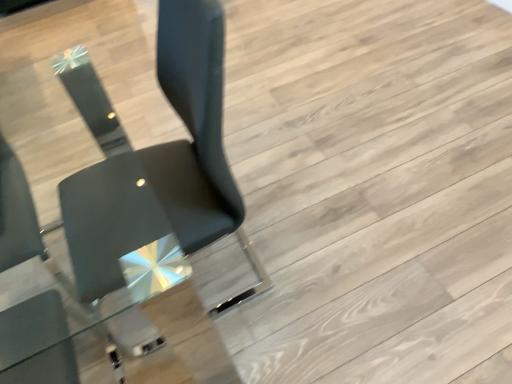
Question: Is matte black chair at center, the second chair in the left-to-right sequence, bigger or smaller than matte black chair at lower left, which is the 1th chair in left-to-right order?

Choices:
 (A) small
 (B) big

Answer: (B)

Question: Looking at their shapes, would you say matte black chair at center, the second chair in the left-to-right sequence, is wider or thinner than matte black chair at lower left, arranged as the second chair when viewed from the right?

Choices:
 (A) thin
 (B) wide

Answer: (B)

Question: Does point (228, 185) appear closer or farther from the camera than point (10, 221)?

Choices:
 (A) farther
 (B) closer

Answer: (B)

Question: Considering the positions of matte black chair at lower left, arranged as the second chair when viewed from the right, and matte black chair at center, the 1th chair when ordered from right to left, in the image, is matte black chair at lower left, arranged as the second chair when viewed from the right, wider or thinner than matte black chair at center, the 1th chair when ordered from right to left,?

Choices:
 (A) thin
 (B) wide

Answer: (A)

Question: Considering the positions of matte black chair at lower left, arranged as the second chair when viewed from the right, and matte black chair at center, the second chair in the left-to-right sequence, in the image, is matte black chair at lower left, arranged as the second chair when viewed from the right, bigger or smaller than matte black chair at center, the second chair in the left-to-right sequence,?

Choices:
 (A) big
 (B) small

Answer: (B)

Question: From the image's perspective, is matte black chair at lower left, arranged as the second chair when viewed from the right, positioned above or below matte black chair at center, the 1th chair when ordered from right to left?

Choices:
 (A) above
 (B) below

Answer: (B)

Question: Considering the positions of matte black chair at lower left, which is the 1th chair in left-to-right order, and matte black chair at center, the 1th chair when ordered from right to left, in the image, is matte black chair at lower left, which is the 1th chair in left-to-right order, taller or shorter than matte black chair at center, the 1th chair when ordered from right to left,?

Choices:
 (A) tall
 (B) short

Answer: (B)